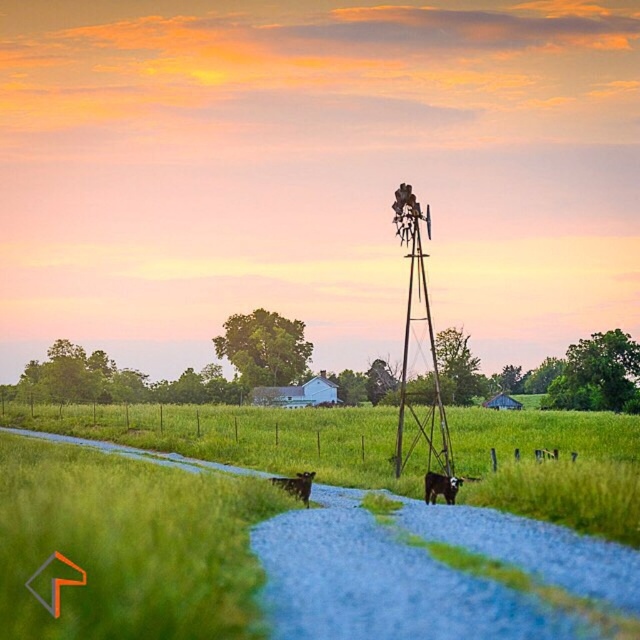
Is point (406, 211) behind point (291, 486)?

Yes, it is behind point (291, 486).

Does rusty metal windmill at center have a lesser width compared to brown furry dog at center?

Incorrect, rusty metal windmill at center's width is not less than brown furry dog at center's.

Is point (408, 189) farther from viewer compared to point (304, 493)?

That is True.

This screenshot has height=640, width=640. I want to click on rusty metal windmill at center, so (x=410, y=342).

Based on the photo, is green grass at center positioned behind black glossy cow at center?

No, green grass at center is closer to the viewer.

Does green grass at center have a greater height compared to black glossy cow at center?

Yes.

Locate an element on the screen. The width and height of the screenshot is (640, 640). green grass at center is located at coordinates (244, 436).

Locate an element on the screen. green grass at center is located at coordinates (244, 436).

How distant is green grass at center from brown furry dog at center?

green grass at center is 56.71 feet away from brown furry dog at center.

Is green grass at center shorter than brown furry dog at center?

No, green grass at center is not shorter than brown furry dog at center.

Is point (291, 461) positioned in front of point (275, 477)?

No, (291, 461) is behind (275, 477).

Locate an element on the screen. green grass at center is located at coordinates (244, 436).